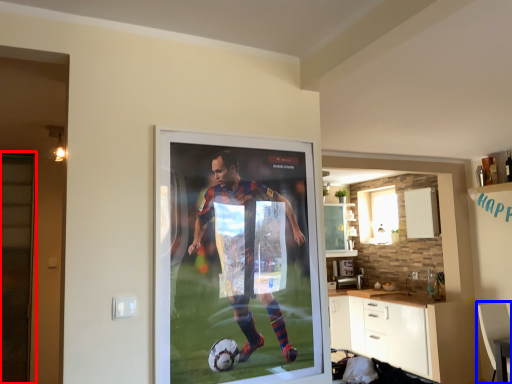
Question: Which object is further to the camera taking this photo, screen door (highlighted by a red box) or armchair (highlighted by a blue box)?

Choices:
 (A) screen door
 (B) armchair

Answer: (B)